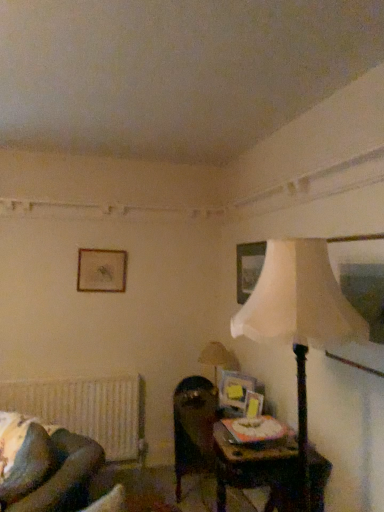
Image resolution: width=384 pixels, height=512 pixels. What do you see at coordinates (45, 466) in the screenshot?
I see `dark brown leather rocking chair at lower left` at bounding box center [45, 466].

Find the location of a particular element. wooden picture frame at center, acting as the fourth picture frame starting from the top is located at coordinates (253, 404).

This screenshot has width=384, height=512. Describe the element at coordinates (253, 404) in the screenshot. I see `wooden picture frame at center, which is counted as the first picture frame, starting from the bottom` at that location.

Describe the element at coordinates (193, 426) in the screenshot. I see `dark brown leather swivel chair at center` at that location.

Where is `white fabric lampshade at right, the 1th lamp from the front`? Image resolution: width=384 pixels, height=512 pixels. white fabric lampshade at right, the 1th lamp from the front is located at coordinates (299, 318).

At what (x,y) coordinates should I click in order to perform the action: click on matte gold picture frame at upper center, acting as the first picture frame starting from the left. Please return your answer as a coordinate pair (x, y). The image size is (384, 512). Looking at the image, I should click on (101, 270).

The height and width of the screenshot is (512, 384). What are the coordinates of `dark brown leather rocking chair at lower left` in the screenshot? It's located at (45, 466).

Is matte wooden picture frame at center-right, the second picture frame from the bottom, smaller than wooden table at lower right?

Yes.

Is wooden table at lower right inside matte wooden picture frame at center-right, the second picture frame from the bottom?

No, wooden table at lower right is not surrounded by matte wooden picture frame at center-right, the second picture frame from the bottom.

Can you confirm if matte wooden picture frame at center-right, the 2th picture frame in the left-to-right sequence, is positioned to the left of wooden table at lower right?

No, matte wooden picture frame at center-right, the 2th picture frame in the left-to-right sequence, is not to the left of wooden table at lower right.

Between matte wooden picture frame at center-right, the 2th picture frame in the left-to-right sequence, and wooden table at lower right, which one has more height?

wooden table at lower right is taller.

Is wooden table at lower right beside white fabric lampshade at right, which appears as the 2th lamp when viewed from the back?

No, wooden table at lower right is not touching white fabric lampshade at right, which appears as the 2th lamp when viewed from the back.

Does point (240, 475) come behind point (300, 336)?

Yes, it is.

The width and height of the screenshot is (384, 512). I want to click on table located on the left of white fabric lampshade at right, the 1th lamp from the front, so click(x=257, y=468).

Is wooden table at lower right closer to the viewer compared to white fabric lampshade at right, which appears as the 2th lamp when viewed from the back?

No, the depth of wooden table at lower right is greater than that of white fabric lampshade at right, which appears as the 2th lamp when viewed from the back.

Does dark brown leather swivel chair at center have a lesser width compared to wooden picture frame at upper center, which is counted as the first picture frame, starting from the right?

No, dark brown leather swivel chair at center is not thinner than wooden picture frame at upper center, which is counted as the first picture frame, starting from the right.

Find the location of a particular element. This screenshot has width=384, height=512. swivel chair behind the wooden picture frame at upper center, which is the second picture frame in top-to-bottom order is located at coordinates (193, 426).

Can you tell me how much dark brown leather swivel chair at center and wooden picture frame at upper center, which is the second picture frame in top-to-bottom order, differ in facing direction?

The facing directions of dark brown leather swivel chair at center and wooden picture frame at upper center, which is the second picture frame in top-to-bottom order, are 90 degrees apart.

Is dark brown leather swivel chair at center with wooden picture frame at upper center, which is counted as the first picture frame, starting from the right?

No, dark brown leather swivel chair at center is not touching wooden picture frame at upper center, which is counted as the first picture frame, starting from the right.

From the image's perspective, is matte beige lampshade at right, the 1th lamp positioned from the back, above wooden table at lower right?

Correct, matte beige lampshade at right, the 1th lamp positioned from the back, appears higher than wooden table at lower right in the image.

Looking at this image, is matte beige lampshade at right, the 1th lamp positioned from the back, turned away from wooden table at lower right?

That's not correct — matte beige lampshade at right, the 1th lamp positioned from the back, is not looking away from wooden table at lower right.

Who is bigger, matte beige lampshade at right, the 1th lamp positioned from the back, or wooden table at lower right?

Bigger between the two is wooden table at lower right.

Is matte beige lampshade at right, marked as the second lamp in a front-to-back arrangement, taller or shorter than wooden table at lower right?

Considering their sizes, matte beige lampshade at right, marked as the second lamp in a front-to-back arrangement, has less height than wooden table at lower right.

Is wooden table at lower right facing towards dark brown leather rocking chair at lower left?

Yes, wooden table at lower right is turned towards dark brown leather rocking chair at lower left.

Locate an element on the screen. rocking chair located on the left of wooden table at lower right is located at coordinates (45, 466).

Measure the distance from wooden table at lower right to dark brown leather rocking chair at lower left.

36.67 inches.

Which of these two, wooden table at lower right or dark brown leather rocking chair at lower left, is bigger?

wooden table at lower right.

From the image's perspective, is matte beige lampshade at right, the 1th lamp positioned from the back, located above or below wooden picture frame at upper center, positioned as the third picture frame in front-to-back order?

matte beige lampshade at right, the 1th lamp positioned from the back, is below wooden picture frame at upper center, positioned as the third picture frame in front-to-back order.

Is matte beige lampshade at right, the 1th lamp positioned from the back, outside of wooden picture frame at upper center, the 3th picture frame from the bottom?

Indeed, matte beige lampshade at right, the 1th lamp positioned from the back, is completely outside wooden picture frame at upper center, the 3th picture frame from the bottom.

Does matte beige lampshade at right, marked as the second lamp in a front-to-back arrangement, have a lesser width compared to wooden picture frame at upper center, positioned as the third picture frame in front-to-back order?

Incorrect, the width of matte beige lampshade at right, marked as the second lamp in a front-to-back arrangement, is not less than that of wooden picture frame at upper center, positioned as the third picture frame in front-to-back order.

Can you tell me how much matte beige lampshade at right, the 1th lamp positioned from the back, and wooden picture frame at upper center, which is the second picture frame in top-to-bottom order, differ in facing direction?

The angular difference between matte beige lampshade at right, the 1th lamp positioned from the back, and wooden picture frame at upper center, which is the second picture frame in top-to-bottom order, is 0.00298 degrees.

From a real-world perspective, is white fabric lampshade at right, the 1th lamp from the front, located higher than matte wooden picture frame at center-right, the 2th picture frame in the left-to-right sequence?

Indeed, from a real-world perspective, white fabric lampshade at right, the 1th lamp from the front, stands above matte wooden picture frame at center-right, the 2th picture frame in the left-to-right sequence.

From the image's perspective, is white fabric lampshade at right, which appears as the 2th lamp when viewed from the back, over matte wooden picture frame at center-right, marked as the third picture frame in a right-to-left arrangement?

Yes, from the image's perspective, white fabric lampshade at right, which appears as the 2th lamp when viewed from the back, is over matte wooden picture frame at center-right, marked as the third picture frame in a right-to-left arrangement.

Is point (301, 433) less distant than point (221, 377)?

Yes, it is in front of point (221, 377).

Where is `table that appears below the matte wooden picture frame at center-right, the second picture frame from the bottom (from a real-world perspective)`? The height and width of the screenshot is (512, 384). table that appears below the matte wooden picture frame at center-right, the second picture frame from the bottom (from a real-world perspective) is located at coordinates (257, 468).

The width and height of the screenshot is (384, 512). Find the location of `lamp that appears in front of the wooden table at lower right`. lamp that appears in front of the wooden table at lower right is located at coordinates (299, 318).

Based on their spatial positions, is wooden picture frame at center, which is the fourth picture frame in back-to-front order, or matte gold picture frame at upper center, which is the 1th picture frame from back to front, further from white textured radiator at lower left?

The object further to white textured radiator at lower left is wooden picture frame at center, which is the fourth picture frame in back-to-front order.

Looking at the image, which one is located closer to matte wooden picture frame at center-right, which ranks as the 3th picture frame in back-to-front order, wooden picture frame at center, acting as the 1th picture frame starting from the front, or wooden table at lower right?

wooden picture frame at center, acting as the 1th picture frame starting from the front, is positioned closer to the anchor matte wooden picture frame at center-right, which ranks as the 3th picture frame in back-to-front order.

Considering their positions, is matte beige lampshade at right, the 1th lamp positioned from the back, positioned closer to wooden picture frame at center, which is the fourth picture frame in back-to-front order, than matte gold picture frame at upper center, the 1th picture frame from the top?

matte beige lampshade at right, the 1th lamp positioned from the back, is positioned closer to the anchor wooden picture frame at center, which is the fourth picture frame in back-to-front order.

Looking at the image, which one is located further to matte gold picture frame at upper center, the 4th picture frame positioned from the front, wooden picture frame at upper center, the 2th picture frame when ordered from back to front, or matte wooden picture frame at center-right, the second picture frame when ordered from front to back?

Based on the image, matte wooden picture frame at center-right, the second picture frame when ordered from front to back, appears to be further to matte gold picture frame at upper center, the 4th picture frame positioned from the front.

When comparing their distances from dark brown leather rocking chair at lower left, does wooden picture frame at center, which is counted as the 3th picture frame, starting from the left, or white fabric lampshade at right, the 1th lamp from the front, seem further?

Based on the image, white fabric lampshade at right, the 1th lamp from the front, appears to be further to dark brown leather rocking chair at lower left.

Estimate the real-world distances between objects in this image. Which object is closer to matte beige lampshade at right, the 1th lamp positioned from the back, white textured radiator at lower left or matte wooden picture frame at center-right, the second picture frame from the bottom?

matte wooden picture frame at center-right, the second picture frame from the bottom, is closer to matte beige lampshade at right, the 1th lamp positioned from the back.

Estimate the real-world distances between objects in this image. Which object is closer to white textured radiator at lower left, wooden picture frame at upper center, which is counted as the first picture frame, starting from the right, or dark brown leather rocking chair at lower left?

dark brown leather rocking chair at lower left is closer to white textured radiator at lower left.

Looking at this image, when comparing their distances from matte beige lampshade at right, marked as the second lamp in a front-to-back arrangement, does wooden picture frame at upper center, the 3th picture frame from the bottom, or white textured radiator at lower left seem further?

white textured radiator at lower left is further to matte beige lampshade at right, marked as the second lamp in a front-to-back arrangement.

Where is `lamp between dark brown leather rocking chair at lower left and matte gold picture frame at upper center, the 1th picture frame from the top, from front to back`? This screenshot has height=512, width=384. lamp between dark brown leather rocking chair at lower left and matte gold picture frame at upper center, the 1th picture frame from the top, from front to back is located at coordinates coord(218,358).

This screenshot has height=512, width=384. Identify the location of rocking chair situated between white textured radiator at lower left and wooden picture frame at upper center, positioned as the third picture frame in front-to-back order, from left to right. (45, 466).

Locate an element on the screen. table between dark brown leather rocking chair at lower left and wooden picture frame at upper center, which is counted as the first picture frame, starting from the right, from left to right is located at coordinates (257, 468).

Identify the location of table situated between white textured radiator at lower left and wooden picture frame at center, acting as the 1th picture frame starting from the front, from left to right. Image resolution: width=384 pixels, height=512 pixels. (257, 468).